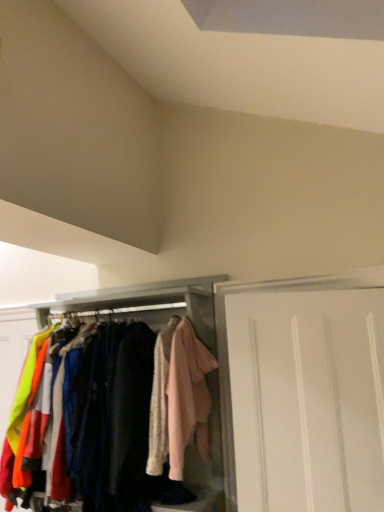
Question: Is the position of white matte cabinet at center less distant than that of light pink fabric at center?

Choices:
 (A) yes
 (B) no

Answer: (B)

Question: Can you confirm if white matte cabinet at center is positioned to the right of light pink fabric at center?

Choices:
 (A) no
 (B) yes

Answer: (A)

Question: From the image's perspective, is white matte cabinet at center located above light pink fabric at center?

Choices:
 (A) no
 (B) yes

Answer: (A)

Question: From a real-world perspective, is white matte cabinet at center on light pink fabric at center?

Choices:
 (A) no
 (B) yes

Answer: (A)

Question: From a real-world perspective, is white matte cabinet at center physically below light pink fabric at center?

Choices:
 (A) yes
 (B) no

Answer: (A)

Question: From the image's perspective, is white matte door at right located above or below light pink fabric at center?

Choices:
 (A) below
 (B) above

Answer: (A)

Question: Considering the positions of point (301, 279) and point (192, 412), is point (301, 279) closer or farther from the camera than point (192, 412)?

Choices:
 (A) closer
 (B) farther

Answer: (B)

Question: Based on their positions, is white matte door at right located to the left or right of light pink fabric at center?

Choices:
 (A) left
 (B) right

Answer: (B)

Question: From a real-world perspective, is white matte door at right above or below light pink fabric at center?

Choices:
 (A) below
 (B) above

Answer: (A)

Question: Is white matte door at right inside or outside of white matte cabinet at center?

Choices:
 (A) outside
 (B) inside

Answer: (A)

Question: Considering the relative positions of white matte door at right and white matte cabinet at center in the image provided, is white matte door at right to the left or to the right of white matte cabinet at center?

Choices:
 (A) right
 (B) left

Answer: (A)

Question: In terms of size, does white matte door at right appear bigger or smaller than white matte cabinet at center?

Choices:
 (A) big
 (B) small

Answer: (B)

Question: Looking at their shapes, would you say white matte door at right is wider or thinner than white matte cabinet at center?

Choices:
 (A) wide
 (B) thin

Answer: (B)

Question: Based on their sizes in the image, would you say light pink fabric at center is bigger or smaller than white matte cabinet at center?

Choices:
 (A) big
 (B) small

Answer: (B)

Question: From the image's perspective, relative to white matte cabinet at center, is light pink fabric at center above or below?

Choices:
 (A) above
 (B) below

Answer: (A)